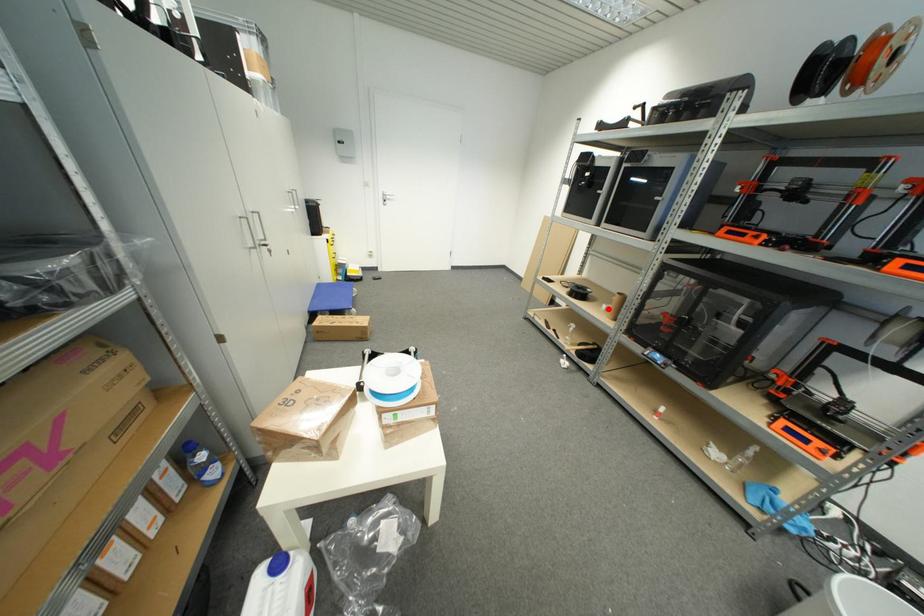
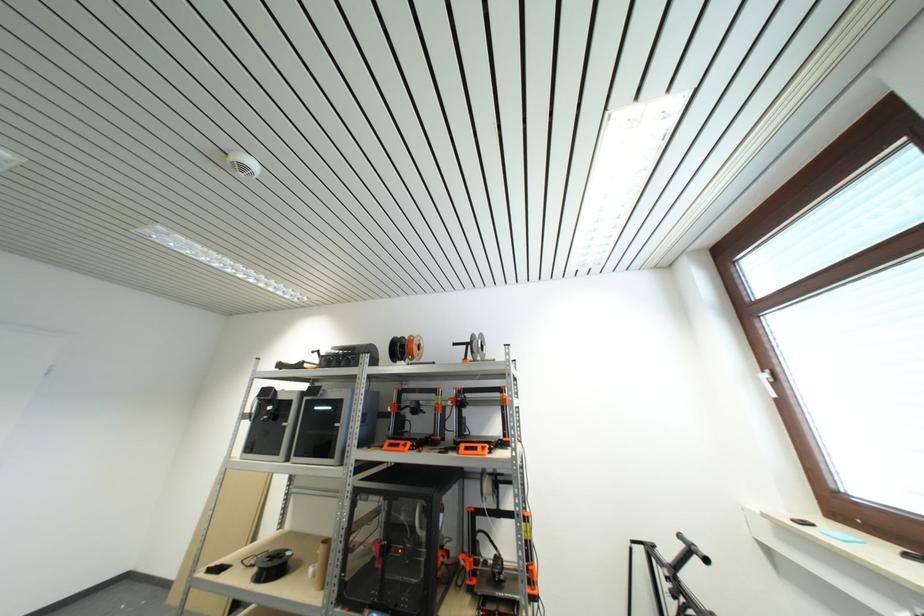
Question: I am providing you with two images of the same scene from different viewpoints. In image1, a red point is highlighted. Considering the same 3D point in image2, which of the following is correct?

Choices:
 (A) It is closer
 (B) It is farther

Answer: (B)